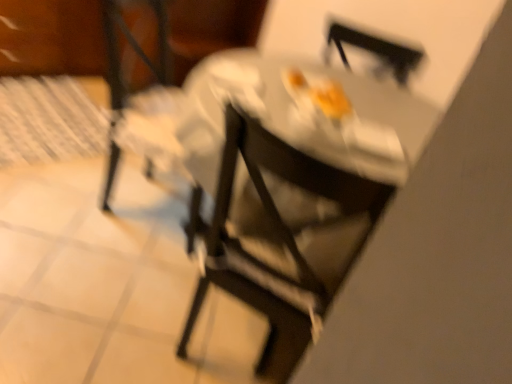
Measure the distance between wooden table at upper left and camera.

The depth of wooden table at upper left is 2.21 meters.

What is the approximate width of matte black chair at center, acting as the 2th chair starting from the right?

matte black chair at center, acting as the 2th chair starting from the right, is 23.35 inches in width.

The image size is (512, 384). Identify the location of matte black chair at center, which is the first chair in left-to-right order. (170, 38).

I want to click on wooden table at upper left, so click(x=51, y=37).

Between matte black chair at center, acting as the 2th chair starting from the right, and wooden table at upper left, which one has larger width?

wooden table at upper left.

Could you measure the distance between matte black chair at center, acting as the 2th chair starting from the right, and wooden table at upper left?

matte black chair at center, acting as the 2th chair starting from the right, and wooden table at upper left are 16.69 inches apart from each other.

Is wooden table at upper left at the back of matte black chair at center, which is the first chair in left-to-right order?

No, matte black chair at center, which is the first chair in left-to-right order,'s orientation is not away from wooden table at upper left.

Is matte black chair at center, acting as the 2th chair starting from the right, bigger or smaller than wooden table at upper left?

Considering their sizes, matte black chair at center, acting as the 2th chair starting from the right, takes up less space than wooden table at upper left.

What's the angular difference between wooden table at upper left and metallic silver chair at center, the 2th chair viewed from the left,'s facing directions?

They differ by 159 degrees in their facing directions.

Is wooden table at upper left not within metallic silver chair at center, the 1th chair viewed from the right?

Indeed, wooden table at upper left is completely outside metallic silver chair at center, the 1th chair viewed from the right.

Is wooden table at upper left aimed at metallic silver chair at center, the 2th chair viewed from the left?

No, wooden table at upper left is not oriented towards metallic silver chair at center, the 2th chair viewed from the left.

From the wooden table at upper left, count 2nd chair to the right and point to it. Please provide its 2D coordinates.

[(281, 238)]

What's the angular difference between metallic silver chair at center, the 2th chair viewed from the left, and wooden table at upper left's facing directions?

The angle between the facing direction of metallic silver chair at center, the 2th chair viewed from the left, and the facing direction of wooden table at upper left is 159 degrees.

Is metallic silver chair at center, the 1th chair viewed from the right, facing away from wooden table at upper left?

No.

Which is in front, point (244, 283) or point (19, 15)?

The point (244, 283) is in front.

Between metallic silver chair at center, the 1th chair viewed from the right, and wooden table at upper left, which one has smaller width?

metallic silver chair at center, the 1th chair viewed from the right.

How far apart are metallic silver chair at center, the 2th chair viewed from the left, and matte black chair at center, acting as the 2th chair starting from the right?

metallic silver chair at center, the 2th chair viewed from the left, is 1.64 meters away from matte black chair at center, acting as the 2th chair starting from the right.

Considering the relative positions of metallic silver chair at center, the 1th chair viewed from the right, and matte black chair at center, which is the first chair in left-to-right order, in the image provided, is metallic silver chair at center, the 1th chair viewed from the right, to the left of matte black chair at center, which is the first chair in left-to-right order, from the viewer's perspective?

No, metallic silver chair at center, the 1th chair viewed from the right, is not to the left of matte black chair at center, which is the first chair in left-to-right order.

Who is taller, metallic silver chair at center, the 1th chair viewed from the right, or matte black chair at center, which is the first chair in left-to-right order?

Standing taller between the two is matte black chair at center, which is the first chair in left-to-right order.

Considering the sizes of objects wooden table at upper left and matte black chair at center, acting as the 2th chair starting from the right, in the image provided, who is shorter, wooden table at upper left or matte black chair at center, acting as the 2th chair starting from the right,?

wooden table at upper left.

Is wooden table at upper left at the left side of matte black chair at center, which is the first chair in left-to-right order?

Correct, you'll find wooden table at upper left to the left of matte black chair at center, which is the first chair in left-to-right order.

Is wooden table at upper left aimed at matte black chair at center, which is the first chair in left-to-right order?

No.

Considering the relative sizes of wooden table at upper left and matte black chair at center, acting as the 2th chair starting from the right, in the image provided, is wooden table at upper left smaller than matte black chair at center, acting as the 2th chair starting from the right,?

Actually, wooden table at upper left might be larger than matte black chair at center, acting as the 2th chair starting from the right.

Based on the photo, do you think matte black chair at center, acting as the 2th chair starting from the right, is within metallic silver chair at center, the 1th chair viewed from the right, or outside of it?

matte black chair at center, acting as the 2th chair starting from the right, is spatially situated outside metallic silver chair at center, the 1th chair viewed from the right.

Consider the image. Which object is closer to the camera taking this photo, matte black chair at center, which is the first chair in left-to-right order, or metallic silver chair at center, the 1th chair viewed from the right?

metallic silver chair at center, the 1th chair viewed from the right.

From a real-world perspective, is matte black chair at center, acting as the 2th chair starting from the right, positioned above or below metallic silver chair at center, the 2th chair viewed from the left?

From a real-world perspective, matte black chair at center, acting as the 2th chair starting from the right, is physically above metallic silver chair at center, the 2th chair viewed from the left.

From the picture: Is matte black chair at center, acting as the 2th chair starting from the right, oriented away from metallic silver chair at center, the 1th chair viewed from the right?

No, matte black chair at center, acting as the 2th chair starting from the right, is not facing away from metallic silver chair at center, the 1th chair viewed from the right.

I want to click on leftover beneath the matte black chair at center, acting as the 2th chair starting from the right (from a real-world perspective), so click(51, 37).

Find the location of a particular element. This screenshot has height=384, width=512. leftover to the left of metallic silver chair at center, the 1th chair viewed from the right is located at coordinates [x=51, y=37].

Looking at the image, which one is located closer to wooden table at upper left, metallic silver chair at center, the 2th chair viewed from the left, or matte black chair at center, acting as the 2th chair starting from the right?

Based on the image, matte black chair at center, acting as the 2th chair starting from the right, appears to be nearer to wooden table at upper left.

Looking at the image, which one is located further to matte black chair at center, which is the first chair in left-to-right order, metallic silver chair at center, the 1th chair viewed from the right, or wooden table at upper left?

Among the two, metallic silver chair at center, the 1th chair viewed from the right, is located further to matte black chair at center, which is the first chair in left-to-right order.

Considering their positions, is wooden table at upper left positioned closer to matte black chair at center, which is the first chair in left-to-right order, than metallic silver chair at center, the 1th chair viewed from the right?

wooden table at upper left lies closer to matte black chair at center, which is the first chair in left-to-right order, than the other object.

When comparing their distances from metallic silver chair at center, the 1th chair viewed from the right, does matte black chair at center, acting as the 2th chair starting from the right, or wooden table at upper left seem further?

The object further to metallic silver chair at center, the 1th chair viewed from the right, is wooden table at upper left.

Looking at this image, when comparing their distances from wooden table at upper left, does matte black chair at center, acting as the 2th chair starting from the right, or metallic silver chair at center, the 1th chair viewed from the right, seem closer?

Based on the image, matte black chair at center, acting as the 2th chair starting from the right, appears to be nearer to wooden table at upper left.

From the image, which object appears to be farther from metallic silver chair at center, the 1th chair viewed from the right, wooden table at upper left or matte black chair at center, which is the first chair in left-to-right order?

wooden table at upper left is further to metallic silver chair at center, the 1th chair viewed from the right.

Identify the location of chair between metallic silver chair at center, the 1th chair viewed from the right, and wooden table at upper left from front to back. The width and height of the screenshot is (512, 384). (170, 38).